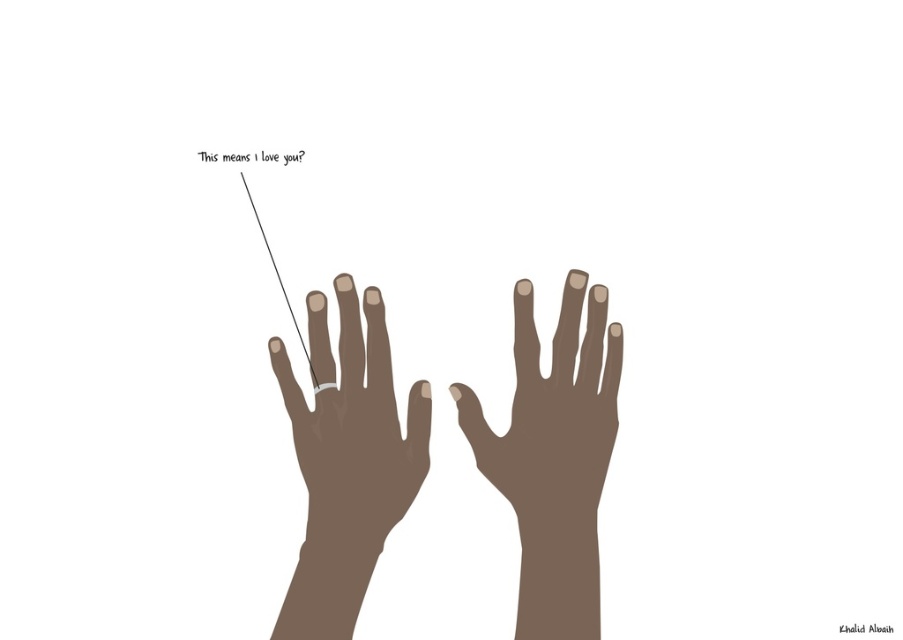
Question: Which object appears farthest from the camera in this image?

Choices:
 (A) matte silver ring at left
 (B) brown matte hand at center

Answer: (B)

Question: Which point is farther to the camera?

Choices:
 (A) (564, 461)
 (B) (383, 314)

Answer: (B)

Question: In this image, where is matte silver ring at left located relative to brown matte hand at center?

Choices:
 (A) above
 (B) below

Answer: (B)

Question: Is matte silver ring at left below brown matte hand at center?

Choices:
 (A) yes
 (B) no

Answer: (A)

Question: Is matte silver ring at left thinner than brown matte hand at center?

Choices:
 (A) yes
 (B) no

Answer: (A)

Question: Among these points, which one is nearest to the camera?

Choices:
 (A) (374, 371)
 (B) (588, 392)

Answer: (B)